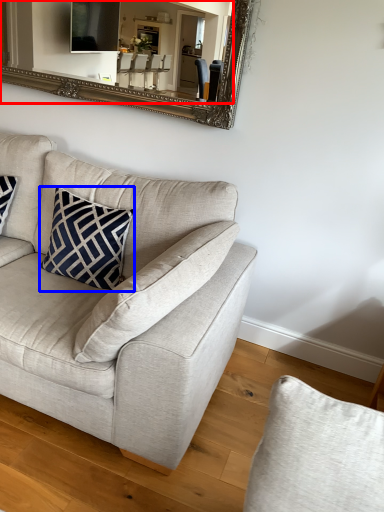
Question: Among these objects, which one is farthest to the camera, mirror (highlighted by a red box) or pillow (highlighted by a blue box)?

Choices:
 (A) mirror
 (B) pillow

Answer: (A)